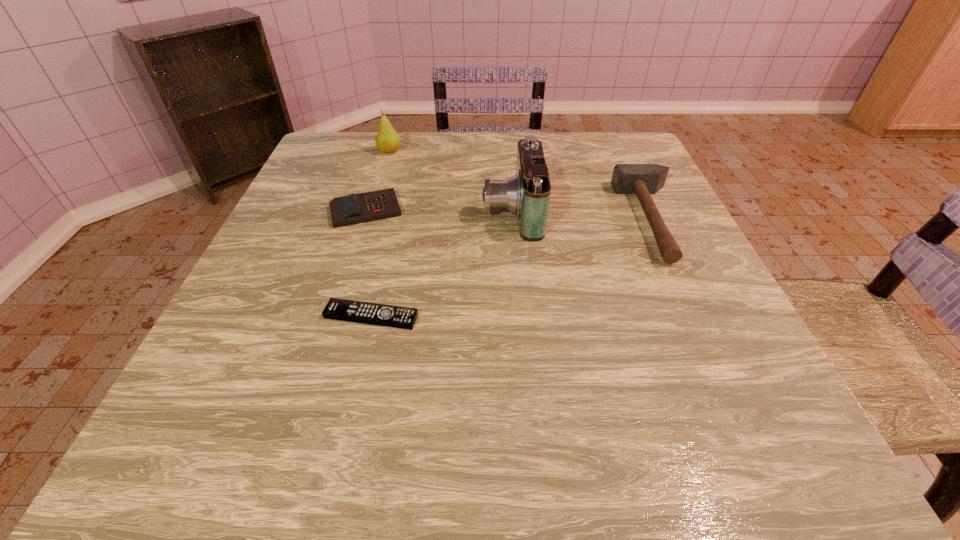
Image resolution: width=960 pixels, height=540 pixels. In order to click on vacant space at the near edge in this screenshot , I will do `click(537, 416)`.

In the image, there is a desktop. Find the location of `vacant space at the left edge`. vacant space at the left edge is located at coordinates (222, 387).

This screenshot has width=960, height=540. Identify the location of free space at the right edge of the desktop. tap(660, 342).

Where is `vacant space at the far left corner`? This screenshot has height=540, width=960. vacant space at the far left corner is located at coordinates (317, 147).

Identify the location of vacant area that lies between the camcorder and the fourth tallest object. The height and width of the screenshot is (540, 960). (439, 210).

At what (x,y) coordinates should I click in order to perform the action: click on vacant region between the second object from right to left and the calculator. Please return your answer as a coordinate pair (x, y). Looking at the image, I should click on (439, 210).

Identify the location of empty space between the hammer and the fourth tallest object. (510, 215).

Identify the location of unoccupied position between the nearest object and the second shortest object. (369, 263).

Where is `free space between the shortest object and the pear`? The image size is (960, 540). free space between the shortest object and the pear is located at coordinates (380, 234).

Where is `empty location between the pear and the remote control`? This screenshot has width=960, height=540. empty location between the pear and the remote control is located at coordinates (380, 234).